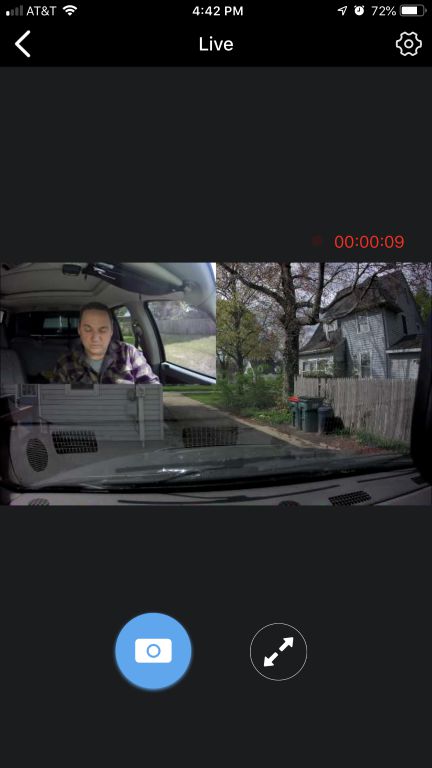
I want to click on garbage can, so click(293, 405), click(307, 414), click(320, 419).